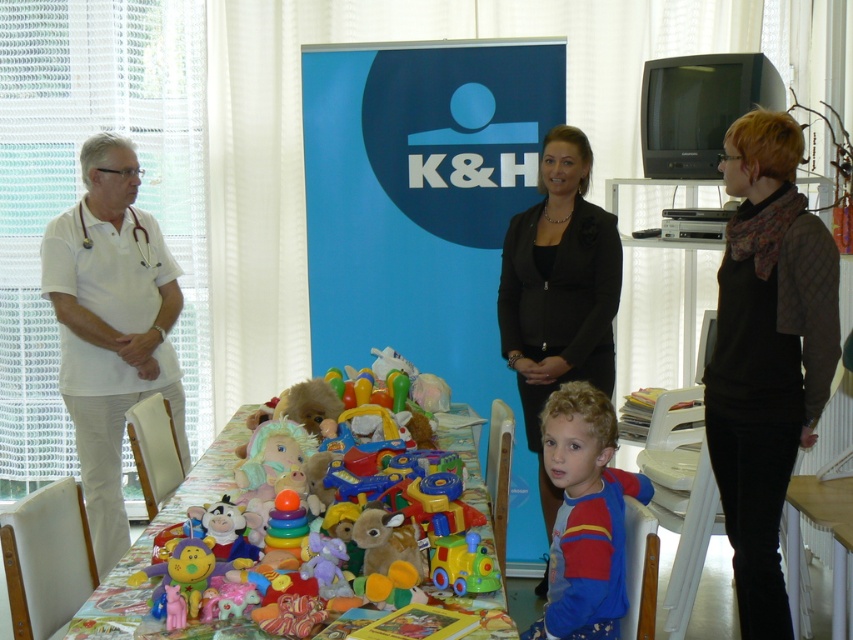
Between white matte shirt at left and black smooth blazer at center, which one appears on the right side from the viewer's perspective?

From the viewer's perspective, black smooth blazer at center appears more on the right side.

Is white matte shirt at left thinner than black smooth blazer at center?

In fact, white matte shirt at left might be wider than black smooth blazer at center.

Is point (148, 316) positioned in front of point (570, 282)?

No.

This screenshot has height=640, width=853. I want to click on white matte shirt at left, so click(111, 324).

Does quilted scarf at center appear under black smooth blazer at center?

Indeed, quilted scarf at center is positioned under black smooth blazer at center.

Is quilted scarf at center closer to the viewer compared to black smooth blazer at center?

Yes.

Identify the location of quilted scarf at center. The width and height of the screenshot is (853, 640). 766,353.

Is black smooth blazer at center closer to the viewer compared to plastic toys at center?

No, it is not.

Does black smooth blazer at center appear under plastic toys at center?

No.

Does point (537, 368) come farther from viewer compared to point (505, 637)?

Yes, point (537, 368) is behind point (505, 637).

I want to click on black smooth blazer at center, so click(x=558, y=291).